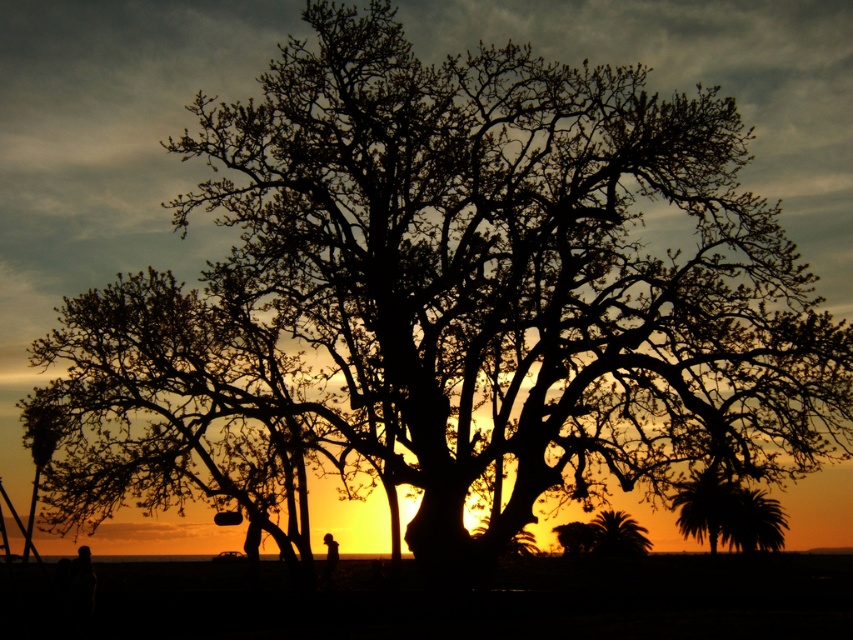
You are a photographer trying to capture the sunset scene. You notice two people in the image, the black matte person at lower center and the black silhouette person at center. Which one appears larger in the photo?

The black matte person at lower center appears larger in the photo because they are much taller than the black silhouette person at center according to the description.